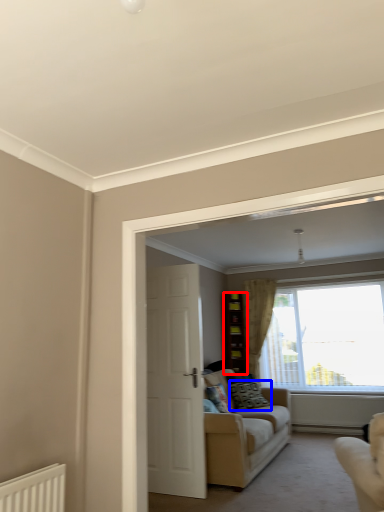
Question: Among these objects, which one is nearest to the camera, cabinetry (highlighted by a red box) or pillow (highlighted by a blue box)?

Choices:
 (A) cabinetry
 (B) pillow

Answer: (B)